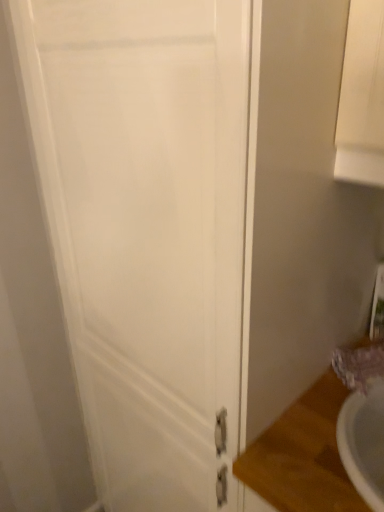
Question: Considering the relative positions of matte purple faucet at lower right and wooden counter top at lower right in the image provided, is matte purple faucet at lower right to the right of wooden counter top at lower right from the viewer's perspective?

Choices:
 (A) yes
 (B) no

Answer: (A)

Question: Can you confirm if matte purple faucet at lower right is thinner than wooden counter top at lower right?

Choices:
 (A) yes
 (B) no

Answer: (A)

Question: Is matte purple faucet at lower right positioned far away from wooden counter top at lower right?

Choices:
 (A) no
 (B) yes

Answer: (A)

Question: Considering the relative sizes of matte purple faucet at lower right and wooden counter top at lower right in the image provided, is matte purple faucet at lower right shorter than wooden counter top at lower right?

Choices:
 (A) no
 (B) yes

Answer: (B)

Question: Is matte purple faucet at lower right positioned before wooden counter top at lower right?

Choices:
 (A) no
 (B) yes

Answer: (A)

Question: Does matte purple faucet at lower right have a greater height compared to wooden counter top at lower right?

Choices:
 (A) no
 (B) yes

Answer: (A)

Question: Considering the relative sizes of matte purple faucet at lower right and white matte door at center in the image provided, is matte purple faucet at lower right smaller than white matte door at center?

Choices:
 (A) yes
 (B) no

Answer: (A)

Question: Can you see matte purple faucet at lower right touching white matte door at center?

Choices:
 (A) no
 (B) yes

Answer: (A)

Question: Considering the relative sizes of matte purple faucet at lower right and white matte door at center in the image provided, is matte purple faucet at lower right shorter than white matte door at center?

Choices:
 (A) no
 (B) yes

Answer: (B)

Question: Considering the relative sizes of matte purple faucet at lower right and white matte door at center in the image provided, is matte purple faucet at lower right thinner than white matte door at center?

Choices:
 (A) no
 (B) yes

Answer: (B)

Question: From a real-world perspective, is matte purple faucet at lower right located higher than white matte door at center?

Choices:
 (A) yes
 (B) no

Answer: (A)

Question: Considering the relative sizes of matte purple faucet at lower right and white matte door at center in the image provided, is matte purple faucet at lower right wider than white matte door at center?

Choices:
 (A) yes
 (B) no

Answer: (B)

Question: Considering the relative sizes of white matte door at center and matte purple faucet at lower right in the image provided, is white matte door at center thinner than matte purple faucet at lower right?

Choices:
 (A) yes
 (B) no

Answer: (B)